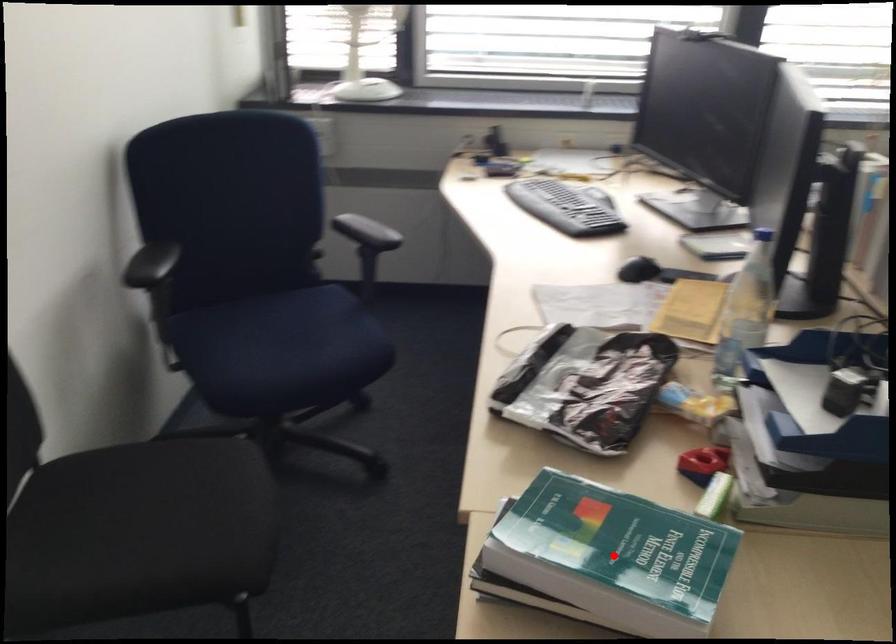
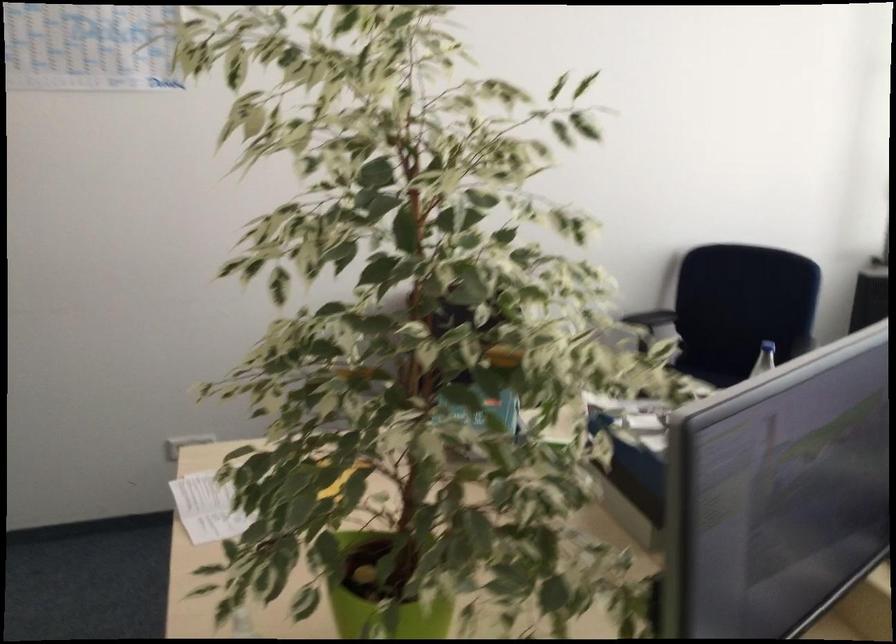
Question: I am providing you with two images of the same scene from different viewpoints. A red point is marked on the first image. Can you still see the location of the red point in image 2?

Choices:
 (A) Yes
 (B) No

Answer: (B)